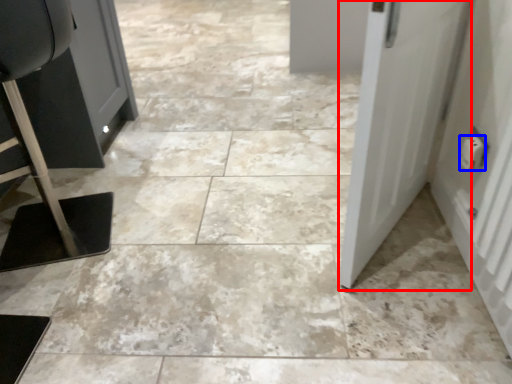
Question: Which object appears farthest to the camera in this image, door (highlighted by a red box) or electric outlet (highlighted by a blue box)?

Choices:
 (A) door
 (B) electric outlet

Answer: (B)